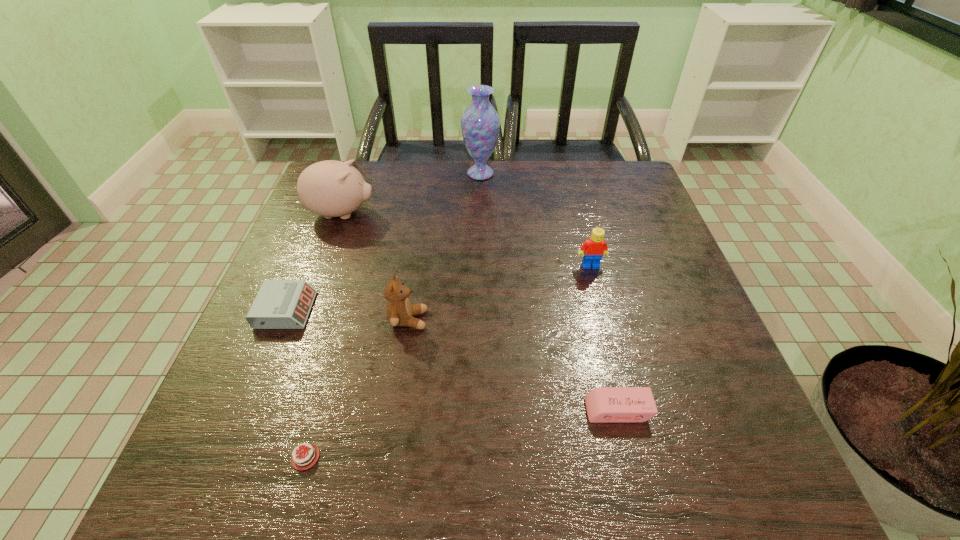
You are a GUI agent. You are given a task and a screenshot of the screen. Output one action in this format:
    pyautogui.click(x=<x>, y=<y>)
    Task: Click on the vase
    
    Given the screenshot: What is the action you would take?
    pyautogui.click(x=480, y=123)

Locate an element on the screen. This screenshot has width=960, height=540. the tallest object is located at coordinates (480, 123).

This screenshot has width=960, height=540. Find the location of `the second farthest object`. the second farthest object is located at coordinates (330, 188).

The width and height of the screenshot is (960, 540). In order to click on the sixth shortest object in this screenshot , I will do `click(330, 188)`.

Identify the location of teddy bear. (400, 311).

Where is `Lego`? This screenshot has height=540, width=960. Lego is located at coordinates (592, 250).

The height and width of the screenshot is (540, 960). Find the location of `alarm clock`. alarm clock is located at coordinates (280, 304).

Locate an element on the screen. This screenshot has height=540, width=960. the sixth farthest object is located at coordinates (603, 404).

Where is `the shortest object`? Image resolution: width=960 pixels, height=540 pixels. the shortest object is located at coordinates pos(309,453).

Locate an element on the screen. chocolate cake is located at coordinates (309, 453).